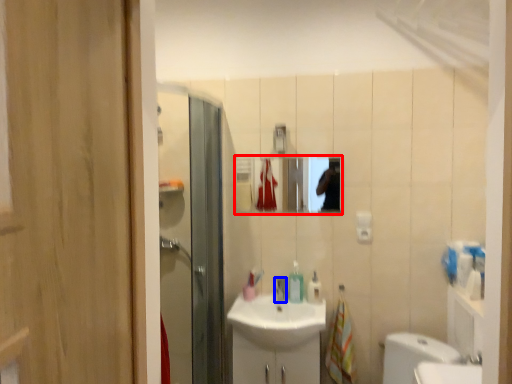
Question: Which object is closer to the camera taking this photo, mirror (highlighted by a red box) or tap (highlighted by a blue box)?

Choices:
 (A) mirror
 (B) tap

Answer: (B)